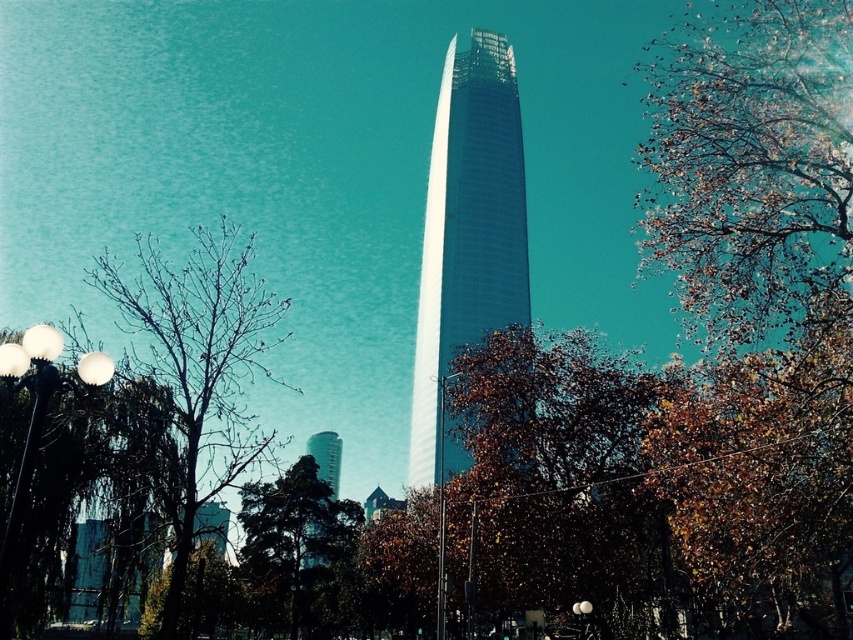
You are a pedestrian standing on the sidewalk. You see the white glossy lamp post at left and the brown leafy tree at lower left. Which object is closer to you?

The white glossy lamp post at left is closer to you because it is in front of the brown leafy tree at lower left.

You are standing at the center of the image and want to walk towards the green leafy tree at center. Which direction should you move?

The green leafy tree at center is already at the center of the image, so you are already facing it. No need to move in any direction.

You are a city planner analyzing the urban layout. You see a point marked at coordinates point (199, 364). What does this point represent in the scene?

The point (199, 364) represents the bare branches at left.